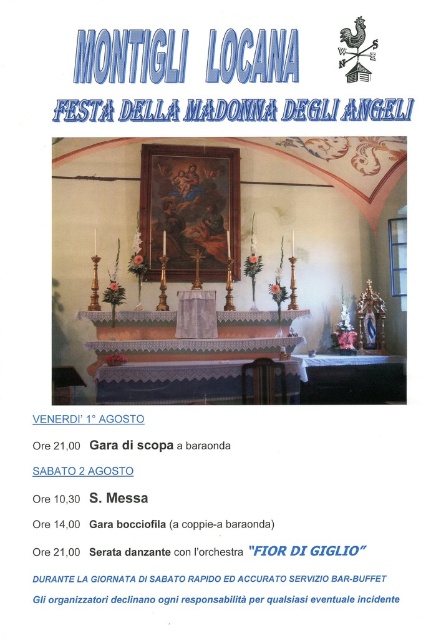
Between blue metallic text at upper center and black paper at lower center, which one is positioned higher?

blue metallic text at upper center is above.

Where is `blue metallic text at upper center`? The image size is (431, 640). blue metallic text at upper center is located at coordinates (197, 109).

Where is `blue metallic text at upper center`? blue metallic text at upper center is located at coordinates (197, 109).

Is matte gold altar at center shorter than black paper at lower center?

No, matte gold altar at center is not shorter than black paper at lower center.

Which is more to the left, matte gold altar at center or black paper at lower center?

From the viewer's perspective, black paper at lower center appears more on the left side.

Measure the distance between point (62, 189) and camera.

They are 7.01 meters apart.

The width and height of the screenshot is (431, 640). I want to click on matte gold altar at center, so click(x=322, y=224).

Does matte gold altar at center have a greater width compared to blue metallic text at upper center?

Yes, matte gold altar at center is wider than blue metallic text at upper center.

The image size is (431, 640). What do you see at coordinates (322, 224) in the screenshot?
I see `matte gold altar at center` at bounding box center [322, 224].

The image size is (431, 640). What are the coordinates of `matte gold altar at center` in the screenshot? It's located at (322, 224).